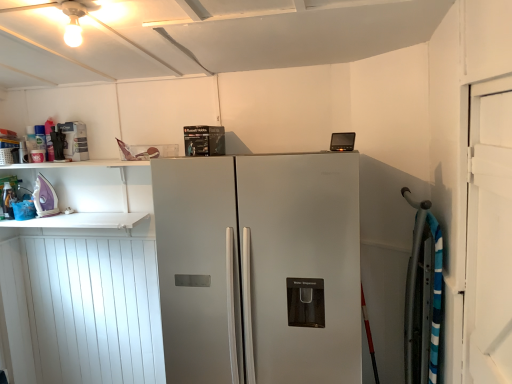
What do you see at coordinates (259, 266) in the screenshot? I see `satin silver refrigerator at center` at bounding box center [259, 266].

Measure the distance between point (498, 277) and camera.

They are 4.63 feet apart.

This screenshot has height=384, width=512. Identify the location of satin silver refrigerator at center. (259, 266).

Does matte white spray can at upper left, the 2th appliance from the bottom, lie behind white wood door at right?

Yes.

Is matte white spray can at upper left, placed as the 1th appliance when sorted from right to left, looking in the opposite direction of white wood door at right?

No, matte white spray can at upper left, placed as the 1th appliance when sorted from right to left, is not facing away from white wood door at right.

Is matte white spray can at upper left, acting as the 2th appliance starting from the left, taller or shorter than white wood door at right?

In the image, matte white spray can at upper left, acting as the 2th appliance starting from the left, appears to be shorter than white wood door at right.

Can you tell me how much matte white spray can at upper left, placed as the 1th appliance when sorted from right to left, and white wood door at right differ in facing direction?

89.7 degrees.

Considering the sizes of objects satin silver refrigerator at center and matte white spray can at upper left, the 2th appliance from the bottom, in the image provided, who is bigger, satin silver refrigerator at center or matte white spray can at upper left, the 2th appliance from the bottom,?

satin silver refrigerator at center.

From a real-world perspective, between satin silver refrigerator at center and matte white spray can at upper left, the 2th appliance from the bottom, who is vertically higher?

matte white spray can at upper left, the 2th appliance from the bottom, from a real-world perspective.

Is satin silver refrigerator at center closer to the viewer compared to matte white spray can at upper left, acting as the 1th appliance starting from the top?

Yes, satin silver refrigerator at center is in front of matte white spray can at upper left, acting as the 1th appliance starting from the top.

Between satin silver refrigerator at center and matte white spray can at upper left, the 2th appliance from the bottom, which one has more height?

satin silver refrigerator at center.

Is purple glossy iron at left, acting as the second appliance starting from the right, closer to camera compared to satin silver refrigerator at center?

That is False.

Is satin silver refrigerator at center a part of purple glossy iron at left, which is the 1th appliance from left to right?

No, satin silver refrigerator at center is not surrounded by purple glossy iron at left, which is the 1th appliance from left to right.

Can you confirm if purple glossy iron at left, acting as the second appliance starting from the right, is thinner than satin silver refrigerator at center?

Yes.

Which of these two, purple glossy iron at left, which is the 2th appliance from top to bottom, or satin silver refrigerator at center, stands shorter?

With less height is purple glossy iron at left, which is the 2th appliance from top to bottom.

Which of these two, white wood door at right or purple glossy iron at left, acting as the second appliance starting from the right, stands taller?

With more height is white wood door at right.

Is white wood door at right spatially inside purple glossy iron at left, acting as the second appliance starting from the right, or outside of it?

white wood door at right is spatially situated outside purple glossy iron at left, acting as the second appliance starting from the right.

From the image's perspective, is white wood door at right located above purple glossy iron at left, which is the 1th appliance from left to right?

Actually, white wood door at right appears below purple glossy iron at left, which is the 1th appliance from left to right, in the image.

Is white wood door at right in front of or behind purple glossy iron at left, acting as the second appliance starting from the right, in the image?

white wood door at right is in front of purple glossy iron at left, acting as the second appliance starting from the right.

Who is shorter, satin silver refrigerator at center or white wood door at right?

With less height is white wood door at right.

Which of these two, satin silver refrigerator at center or white wood door at right, is bigger?

satin silver refrigerator at center.

From the image's perspective, between satin silver refrigerator at center and white wood door at right, who is located below?

satin silver refrigerator at center.

Is point (346, 154) closer to viewer compared to point (501, 80)?

No, (346, 154) is further to viewer.

Does matte white spray can at upper left, the 2th appliance from the bottom, have a lesser height compared to purple glossy iron at left, acting as the 1th appliance starting from the bottom?

Yes, matte white spray can at upper left, the 2th appliance from the bottom, is shorter than purple glossy iron at left, acting as the 1th appliance starting from the bottom.

Which is in front, point (87, 157) or point (50, 183)?

The point (87, 157) is closer to the camera.

Looking at the image, does matte white spray can at upper left, the 2th appliance from the bottom, seem bigger or smaller compared to purple glossy iron at left, acting as the second appliance starting from the right?

In the image, matte white spray can at upper left, the 2th appliance from the bottom, appears to be smaller than purple glossy iron at left, acting as the second appliance starting from the right.

Measure the distance between matte white spray can at upper left, placed as the 1th appliance when sorted from right to left, and purple glossy iron at left, acting as the 1th appliance starting from the bottom.

They are 14.92 inches apart.

Looking at this image, which point is more distant from viewer, (66, 145) or (207, 287)?

The point (66, 145) is behind.

From a real-world perspective, is matte white spray can at upper left, the 2th appliance from the bottom, under satin silver refrigerator at center?

Incorrect, from a real-world perspective, matte white spray can at upper left, the 2th appliance from the bottom, is higher than satin silver refrigerator at center.

Is the surface of matte white spray can at upper left, the 2th appliance from the bottom, in direct contact with satin silver refrigerator at center?

No, matte white spray can at upper left, the 2th appliance from the bottom, is not next to satin silver refrigerator at center.

Does matte white spray can at upper left, the 2th appliance from the bottom, have a larger size compared to satin silver refrigerator at center?

No.

You are a GUI agent. You are given a task and a screenshot of the screen. Output one action in this format:
    pyautogui.click(x=<x>, y=<y>)
    Task: Click on the door below the matte white spray can at upper left, acting as the 1th appliance starting from the top (from a real-world perspective)
    
    Given the screenshot: What is the action you would take?
    pyautogui.click(x=489, y=235)

Where is `refrigerator below the matte white spray can at upper left, placed as the 1th appliance when sorted from right to left (from the image's perspective)`? Image resolution: width=512 pixels, height=384 pixels. refrigerator below the matte white spray can at upper left, placed as the 1th appliance when sorted from right to left (from the image's perspective) is located at coordinates (259, 266).

Which object lies nearer to the anchor point purple glossy iron at left, which is the 2th appliance from top to bottom, matte white spray can at upper left, the 2th appliance from the bottom, or white wood door at right?

matte white spray can at upper left, the 2th appliance from the bottom, is closer to purple glossy iron at left, which is the 2th appliance from top to bottom.

From the image, which object appears to be nearer to purple glossy iron at left, acting as the 1th appliance starting from the bottom, satin silver refrigerator at center or matte white spray can at upper left, placed as the 1th appliance when sorted from right to left?

Among the two, matte white spray can at upper left, placed as the 1th appliance when sorted from right to left, is located nearer to purple glossy iron at left, acting as the 1th appliance starting from the bottom.

Based on their spatial positions, is matte white spray can at upper left, placed as the 1th appliance when sorted from right to left, or satin silver refrigerator at center closer to white wood door at right?

satin silver refrigerator at center is positioned closer to the anchor white wood door at right.

Estimate the real-world distances between objects in this image. Which object is closer to white wood door at right, matte white spray can at upper left, acting as the 1th appliance starting from the top, or purple glossy iron at left, which is the 1th appliance from left to right?

matte white spray can at upper left, acting as the 1th appliance starting from the top.

Based on their spatial positions, is matte white spray can at upper left, the 2th appliance from the bottom, or satin silver refrigerator at center further from purple glossy iron at left, which is the 1th appliance from left to right?

The object further to purple glossy iron at left, which is the 1th appliance from left to right, is satin silver refrigerator at center.

Considering their positions, is satin silver refrigerator at center positioned further to purple glossy iron at left, acting as the second appliance starting from the right, than white wood door at right?

Based on the image, white wood door at right appears to be further to purple glossy iron at left, acting as the second appliance starting from the right.

From the image, which object appears to be nearer to satin silver refrigerator at center, matte white spray can at upper left, acting as the 1th appliance starting from the top, or purple glossy iron at left, which is the 1th appliance from left to right?

matte white spray can at upper left, acting as the 1th appliance starting from the top, is closer to satin silver refrigerator at center.

From the image, which object appears to be nearer to purple glossy iron at left, which is the 1th appliance from left to right, white wood door at right or matte white spray can at upper left, acting as the 2th appliance starting from the left?

matte white spray can at upper left, acting as the 2th appliance starting from the left.

Locate an element on the screen. Image resolution: width=512 pixels, height=384 pixels. appliance between purple glossy iron at left, which is the 2th appliance from top to bottom, and white wood door at right from left to right is located at coordinates (75, 140).

Where is `appliance between purple glossy iron at left, which is the 1th appliance from left to right, and satin silver refrigerator at center from left to right`? This screenshot has height=384, width=512. appliance between purple glossy iron at left, which is the 1th appliance from left to right, and satin silver refrigerator at center from left to right is located at coordinates (75, 140).

Locate an element on the screen. The height and width of the screenshot is (384, 512). refrigerator situated between purple glossy iron at left, which is the 2th appliance from top to bottom, and white wood door at right from left to right is located at coordinates (259, 266).

Find the location of a particular element. This screenshot has height=384, width=512. refrigerator located between matte white spray can at upper left, acting as the 1th appliance starting from the top, and white wood door at right in the left-right direction is located at coordinates (x=259, y=266).